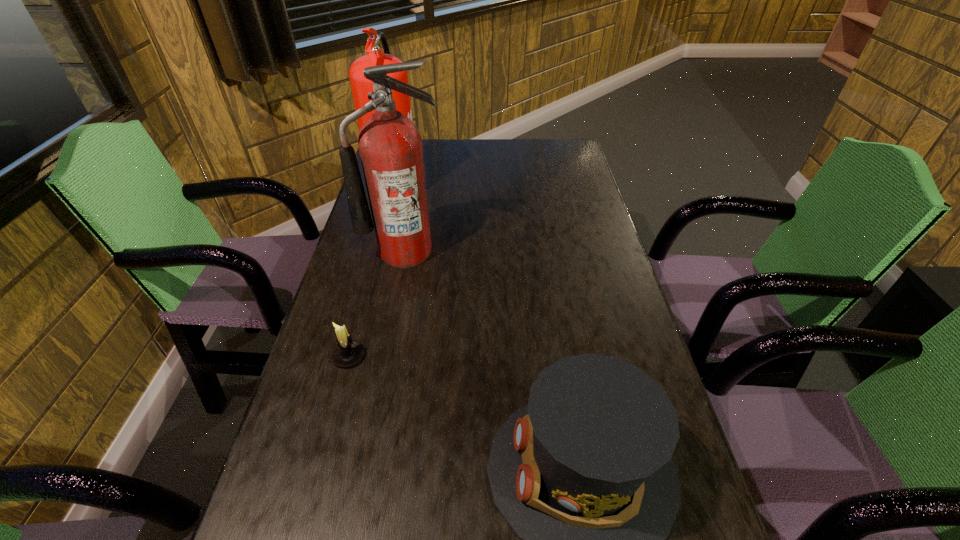
The height and width of the screenshot is (540, 960). Find the location of `vacant space at the far edge of the desktop`. vacant space at the far edge of the desktop is located at coordinates (524, 142).

The image size is (960, 540). I want to click on vacant space at the left edge, so click(315, 428).

Locate an element on the screen. The image size is (960, 540). free point at the right edge is located at coordinates (566, 245).

The image size is (960, 540). Identify the location of vacant space that's between the farther fire extinguisher and the candle holder. (373, 270).

In order to click on free space between the farther fire extinguisher and the shortest object in this screenshot , I will do `click(373, 270)`.

Locate which object is the third closest to the second farthest object. Please provide its 2D coordinates. Your answer should be formatted as a tuple, i.e. [(x, y)], where the tuple contains the x and y coordinates of a point satisfying the conditions above.

[(583, 474)]

Find the location of a particular element. the third closest object to the dress hat is located at coordinates (360, 86).

Where is `blank space that satisfies the following two spatial constraints: 1. towards the nozzle of the farther fire extinguisher; 2. on the front side of the shortest object`? blank space that satisfies the following two spatial constraints: 1. towards the nozzle of the farther fire extinguisher; 2. on the front side of the shortest object is located at coordinates (353, 356).